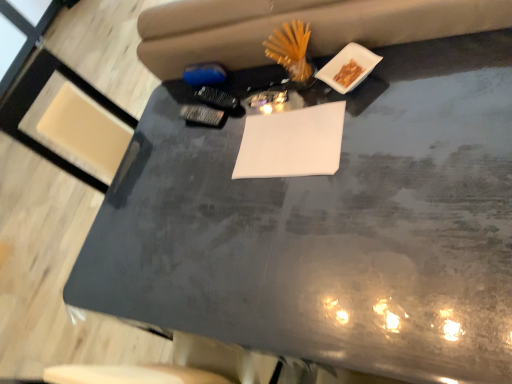
This screenshot has height=384, width=512. Find the location of `free space above white paper at center (from a real-world perspective)`. free space above white paper at center (from a real-world perspective) is located at coordinates (289, 140).